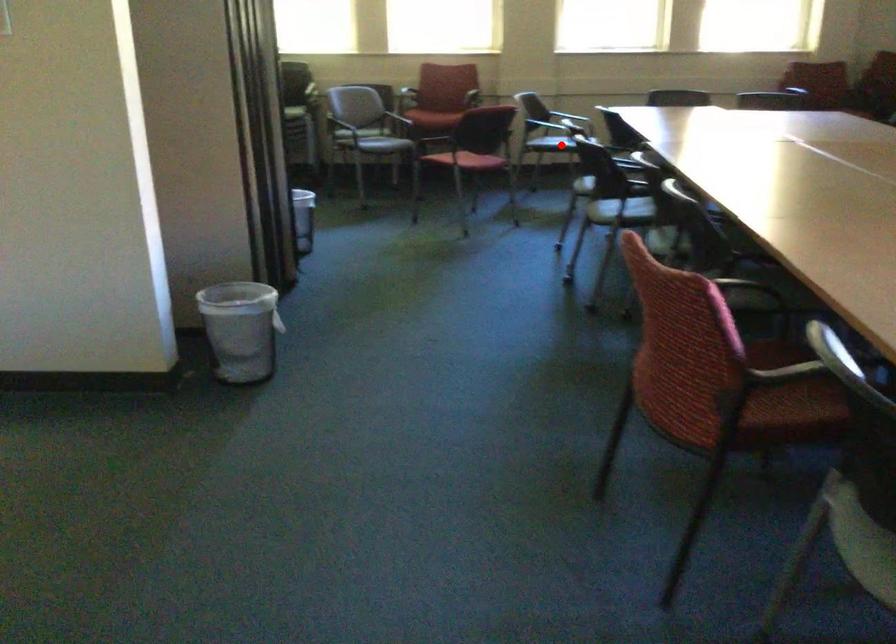
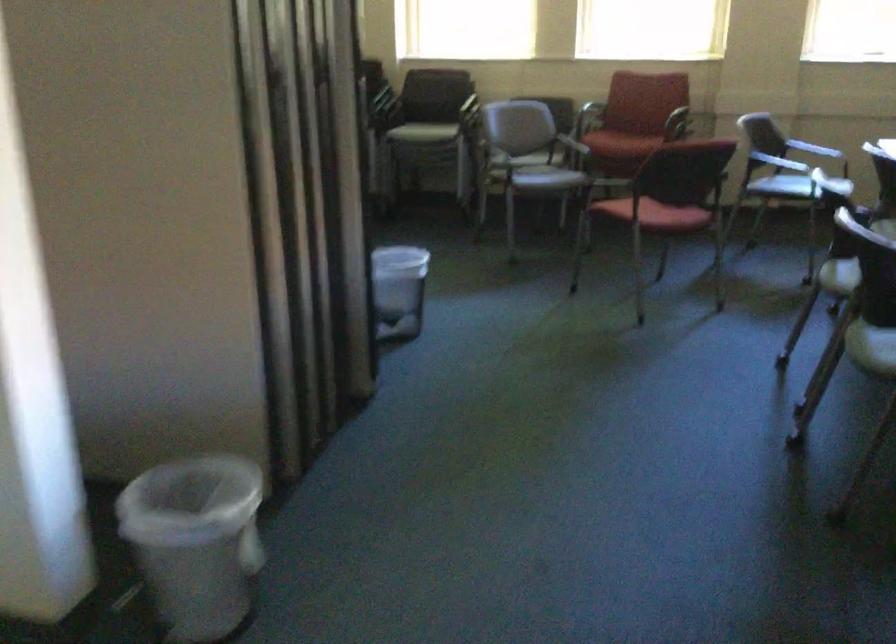
Question: I am providing you with two images of the same scene from different viewpoints. Image1 has a red point marked. In image2, the corresponding 3D location appears at what relative position? Reply with the corresponding letter.

Choices:
 (A) Closer
 (B) Farther

Answer: (A)